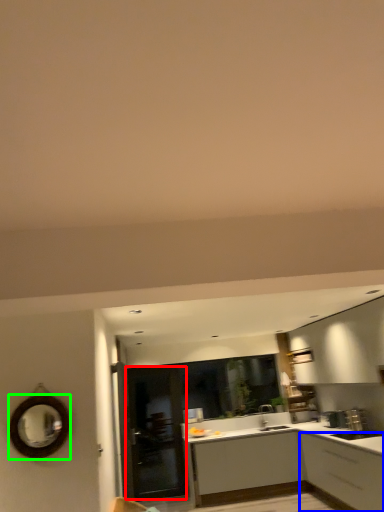
Question: Which object is positioned closest to glass door (highlighted by a red box)? Select from cabinetry (highlighted by a blue box) and mirror (highlighted by a green box).

Choices:
 (A) cabinetry
 (B) mirror

Answer: (A)